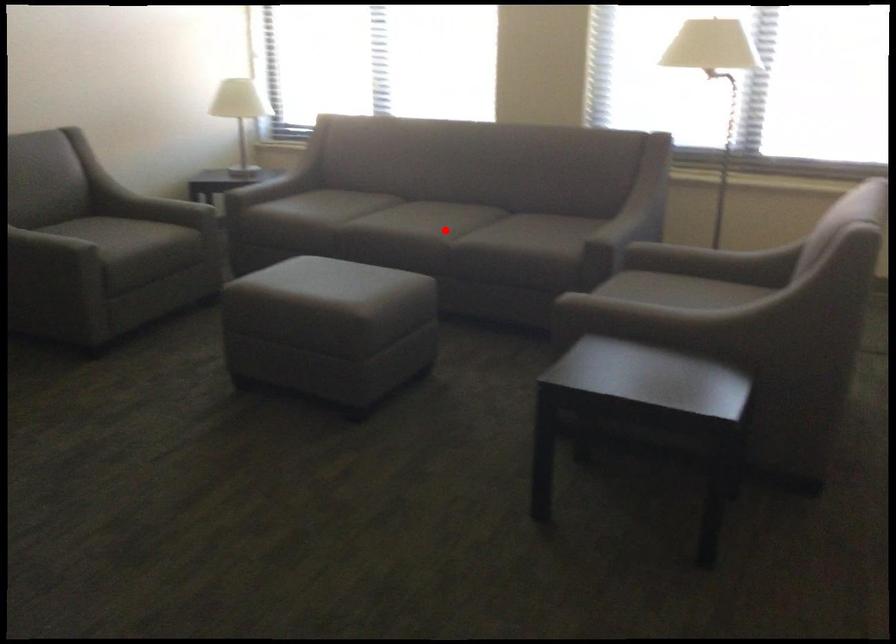
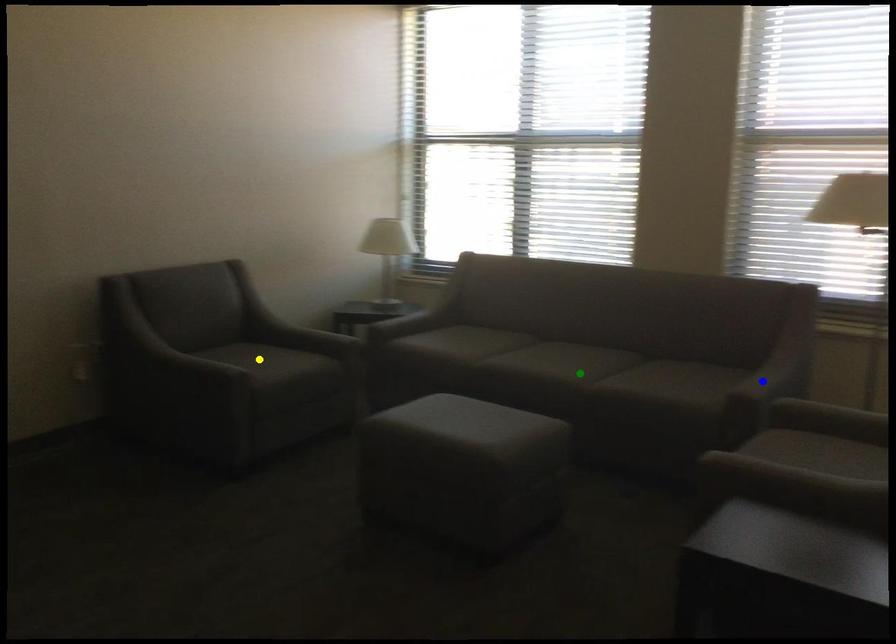
Question: I am providing you with two images of the same scene from different viewpoints. A red point is marked on the first image. You are given multiple points on the second image. Which point in image 2 is actually the same real-world point as the red point in image 1?

Choices:
 (A) green point
 (B) yellow point
 (C) blue point

Answer: (A)